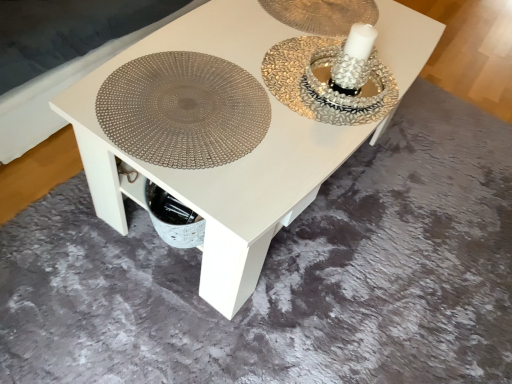
Locate an element on the screen. This screenshot has width=512, height=384. free space in front of white glossy table at center is located at coordinates (219, 317).